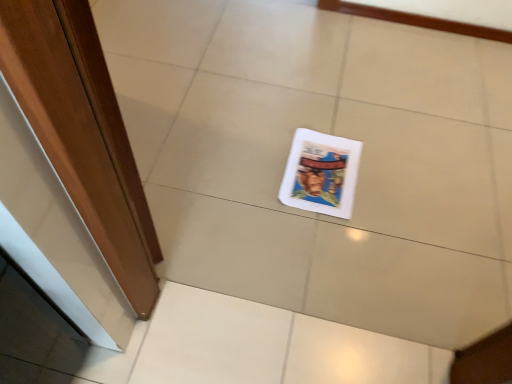
Where is `free spot behind white glossy magazine at center`? The width and height of the screenshot is (512, 384). free spot behind white glossy magazine at center is located at coordinates (330, 114).